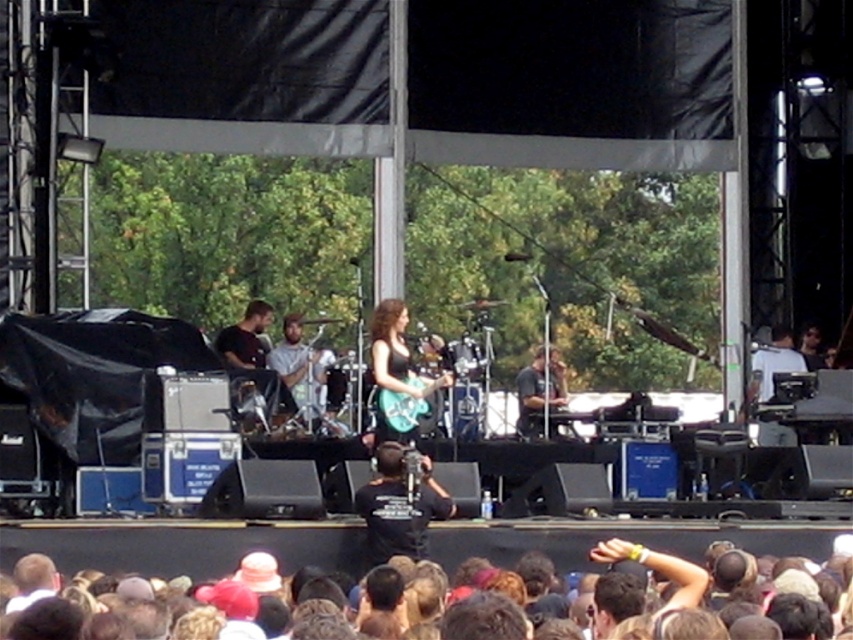
From the picture: Is dark brown hair at lower center bigger than black t-shirt at center?

Yes, dark brown hair at lower center is bigger than black t-shirt at center.

Which is in front, point (10, 534) or point (427, 502)?

Positioned in front is point (10, 534).

Between point (459, 541) and point (428, 509), which one is positioned behind?

Point (459, 541)

This screenshot has width=853, height=640. Find the location of `dark brown hair at lower center`. dark brown hair at lower center is located at coordinates (183, 548).

Can you confirm if black t-shirt at center is positioned to the left of shiny black guitar at center?

Incorrect, black t-shirt at center is not on the left side of shiny black guitar at center.

Which is in front, point (413, 540) or point (397, 336)?

Point (413, 540) is in front.

Is point (438, 497) positioned before point (410, 397)?

That is True.

Locate an element on the screen. The height and width of the screenshot is (640, 853). black t-shirt at center is located at coordinates (398, 506).

Which is below, dark brown hair at lower center or shiny black guitar at center?

dark brown hair at lower center is below.

Is dark brown hair at lower center below shiny black guitar at center?

Correct, dark brown hair at lower center is located below shiny black guitar at center.

Locate an element on the screen. dark brown hair at lower center is located at coordinates (183, 548).